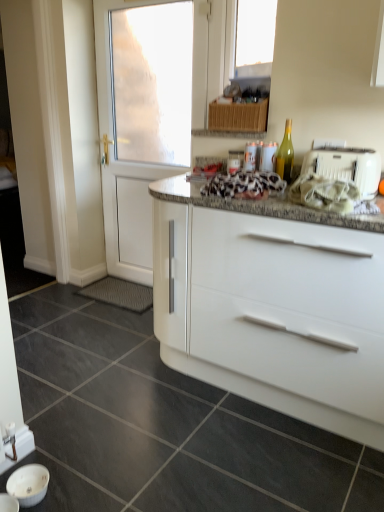
Locate an element on the screen. The image size is (384, 512). free point behind white glossy sink at lower left is located at coordinates (64, 453).